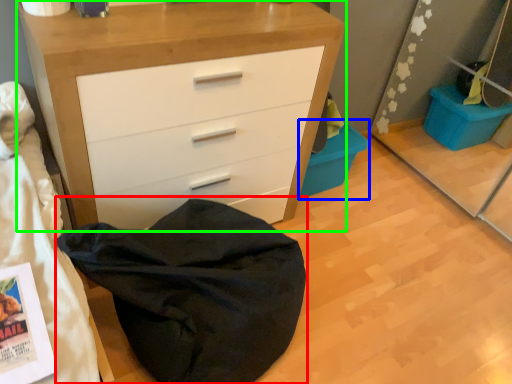
Question: Based on their relative distances, which object is farther from bean bag chair (highlighted by a red box)? Choose from cabinetry (highlighted by a blue box) and chest of drawers (highlighted by a green box).

Choices:
 (A) cabinetry
 (B) chest of drawers

Answer: (A)